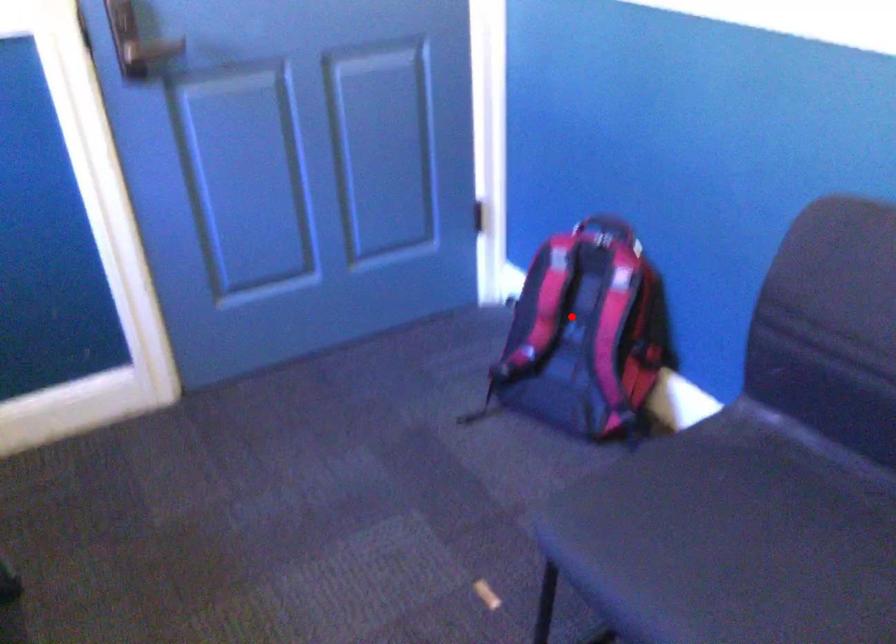
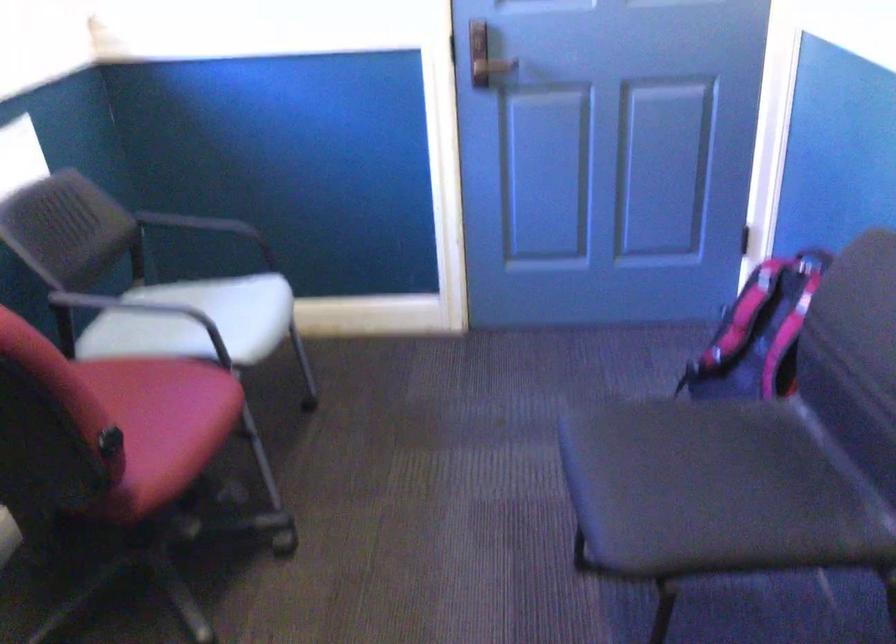
Find the pixel in the second image that matches the highlighted location in the first image.

(759, 333)